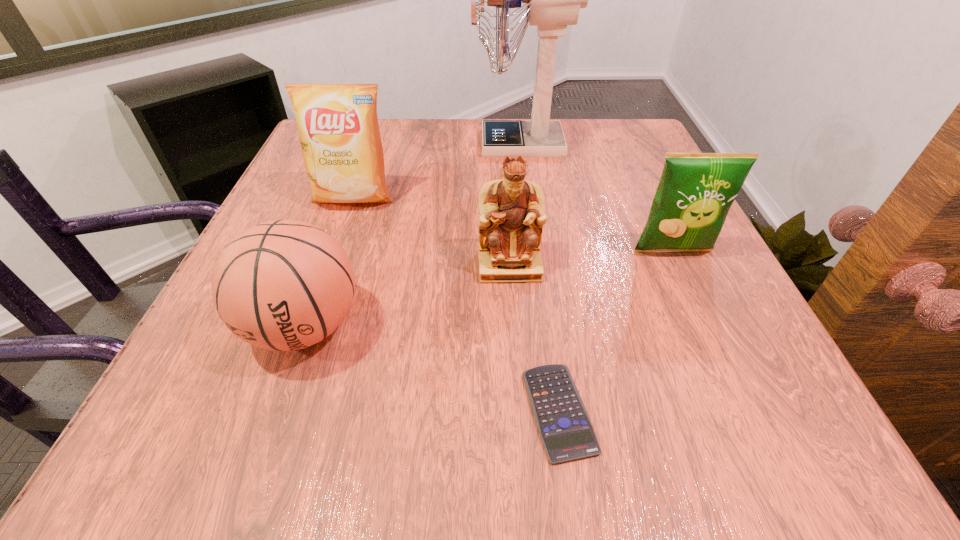
Identify the location of fan. (553, 0).

I want to click on the farthest object, so click(x=553, y=0).

Locate an element on the screen. The height and width of the screenshot is (540, 960). the farther crisp (potato chip) is located at coordinates (338, 127).

The height and width of the screenshot is (540, 960). In order to click on the fifth nearest object in this screenshot , I will do `click(338, 127)`.

Locate an element on the screen. The width and height of the screenshot is (960, 540). figurine is located at coordinates (511, 211).

Locate an element on the screen. the right crisp (potato chip) is located at coordinates (696, 190).

At what (x,y) coordinates should I click in order to perform the action: click on the nearer crisp (potato chip). Please return your answer as a coordinate pair (x, y). Image resolution: width=960 pixels, height=540 pixels. Looking at the image, I should click on (696, 190).

Identify the location of basketball. The height and width of the screenshot is (540, 960). (282, 285).

Identify the location of calculator. The image size is (960, 540). (565, 428).

Where is `free location located 0.390m on the front-facing side of the farthest object`? The width and height of the screenshot is (960, 540). free location located 0.390m on the front-facing side of the farthest object is located at coordinates (311, 144).